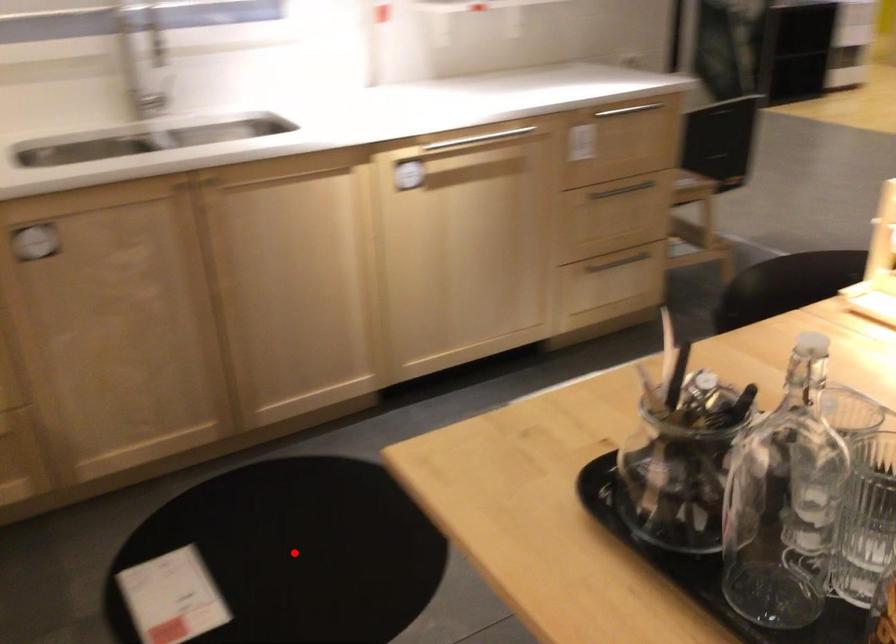
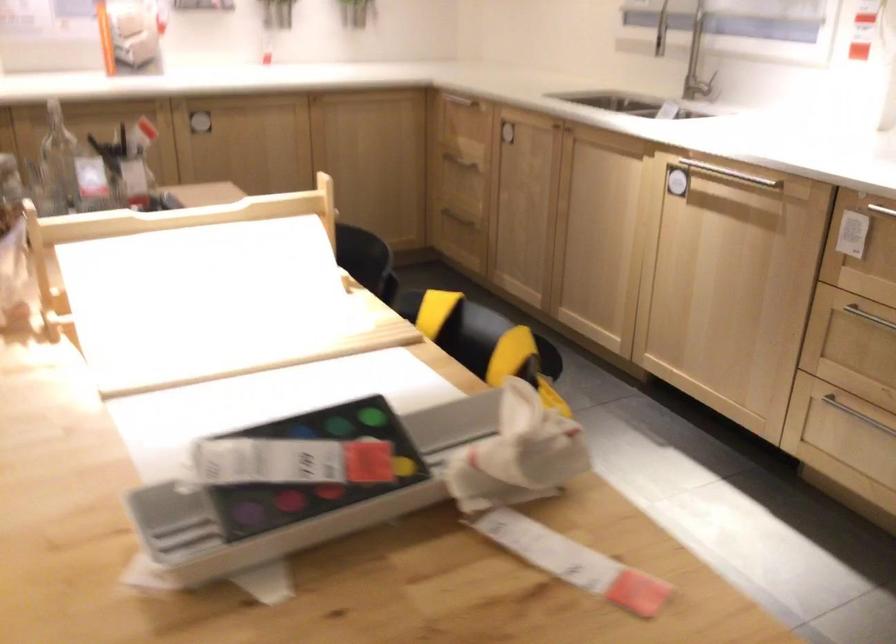
Question: I am providing you with two images of the same scene from different viewpoints. A red point is marked on the first image. Is the red point's position out of view in image 2?

Choices:
 (A) Yes
 (B) No

Answer: (A)